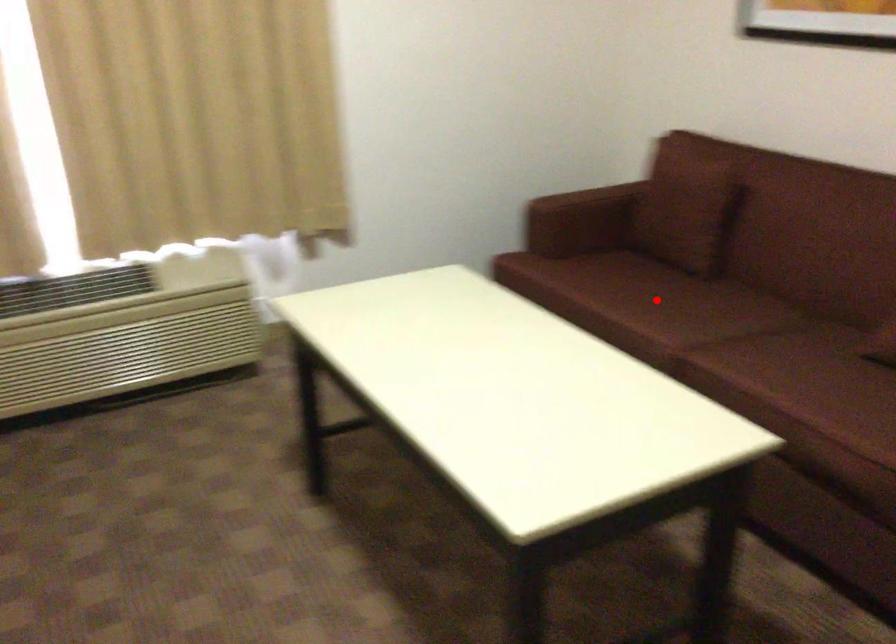
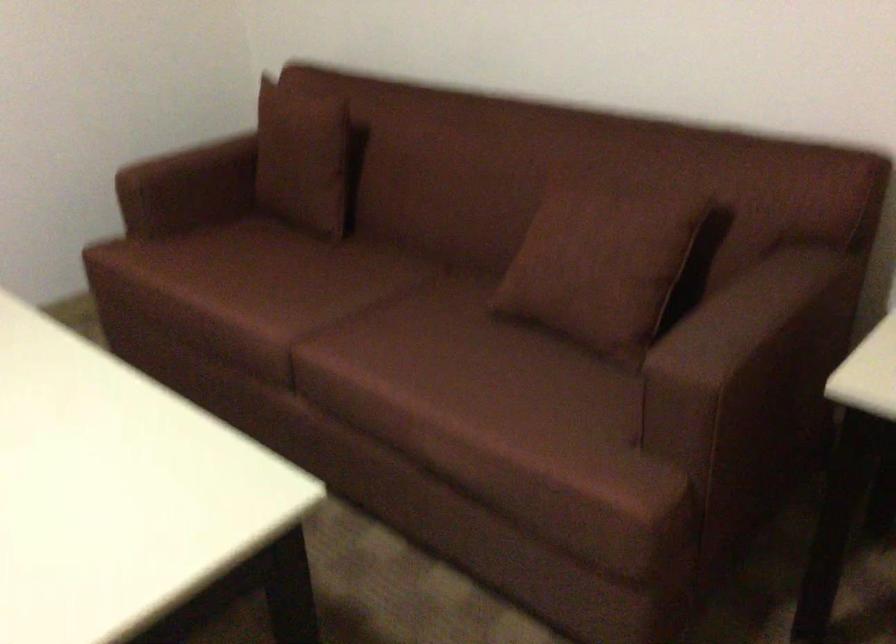
Question: I am providing you with two images of the same scene from different viewpoints. Given a red point in image1, look at the same physical point in image2. Is it:

Choices:
 (A) Closer to the viewpoint
 (B) Farther from the viewpoint

Answer: (A)